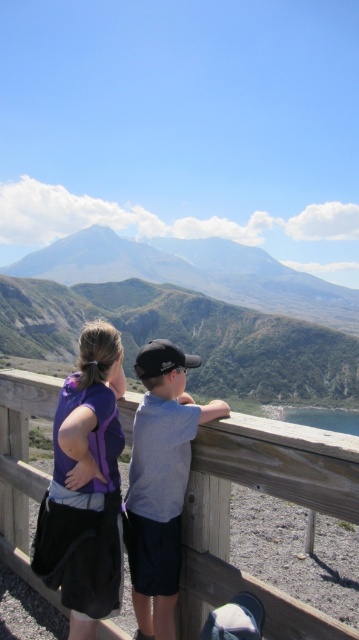
Is the position of wooden at center less distant than that of purple fabric shirt at left?

That is True.

Where is `wooden at center`? This screenshot has width=359, height=640. wooden at center is located at coordinates 266,492.

Based on the photo, which is above, green grassy mountain at upper center or wooden at center?

green grassy mountain at upper center is higher up.

Is green grassy mountain at upper center smaller than wooden at center?

No.

Where is `green grassy mountain at upper center`? This screenshot has height=640, width=359. green grassy mountain at upper center is located at coordinates (189, 314).

Which is in front, point (192, 317) or point (174, 518)?

Point (174, 518)

At what (x,y) coordinates should I click in order to perform the action: click on green grassy mountain at upper center. Please return your answer as a coordinate pair (x, y). The width and height of the screenshot is (359, 640). Looking at the image, I should click on (189, 314).